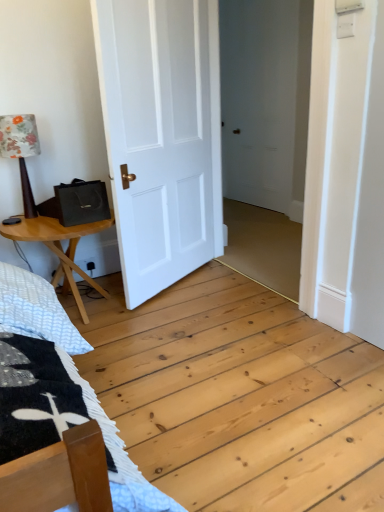
Question: Considering the positions of floral fabric lampshade at left and white matte door at center in the image, is floral fabric lampshade at left bigger or smaller than white matte door at center?

Choices:
 (A) big
 (B) small

Answer: (B)

Question: Looking at their shapes, would you say floral fabric lampshade at left is wider or thinner than white matte door at center?

Choices:
 (A) thin
 (B) wide

Answer: (B)

Question: Estimate the real-world distances between objects in this image. Which object is closer to the white matte door at center?

Choices:
 (A) floral fabric lampshade at left
 (B) wooden table at left

Answer: (B)

Question: Estimate the real-world distances between objects in this image. Which object is closer to the floral fabric lampshade at left?

Choices:
 (A) white matte door at center
 (B) wooden table at left

Answer: (B)